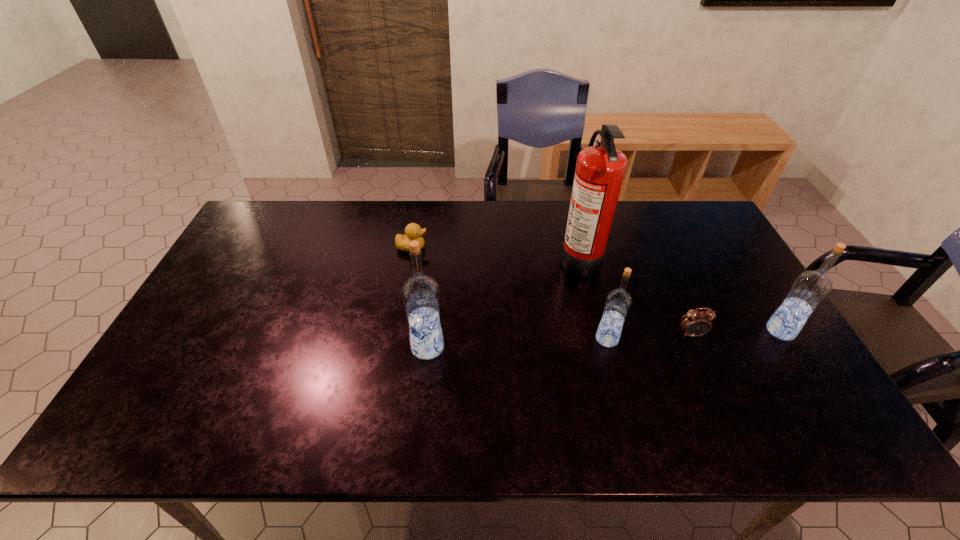
I want to click on the leftmost vodka, so click(420, 293).

Locate an element on the screen. the second vodka from left to right is located at coordinates (618, 302).

I want to click on the fourth tallest object, so click(x=618, y=302).

The image size is (960, 540). In order to click on the rightmost object in this screenshot , I will do `click(810, 288)`.

Locate an element on the screen. The width and height of the screenshot is (960, 540). the fourth shortest object is located at coordinates (810, 288).

Where is `the fifth object from left to right`? the fifth object from left to right is located at coordinates [695, 323].

The height and width of the screenshot is (540, 960). I want to click on duckling, so click(413, 231).

The height and width of the screenshot is (540, 960). In order to click on fire extinguisher in this screenshot , I will do `click(600, 169)`.

Image resolution: width=960 pixels, height=540 pixels. I want to click on vacant space situated on the left of the leftmost vodka, so click(x=326, y=347).

Identify the location of vacant area located 0.220m on the left of the second vodka from left to right. The image size is (960, 540). (512, 339).